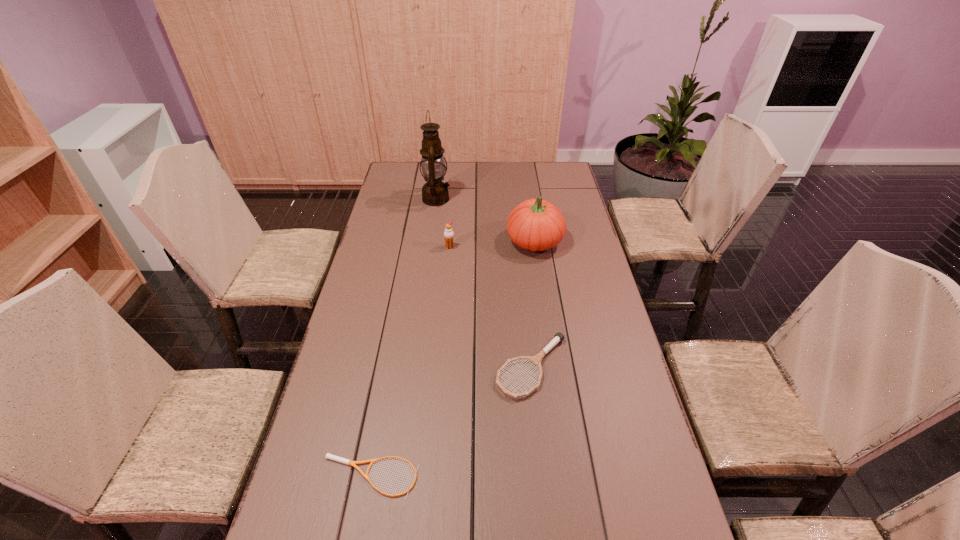
Identify the location of the closest object relative to the left tennis racket. The image size is (960, 540). (559, 337).

The height and width of the screenshot is (540, 960). Identify the location of vacant position in the image that satisfies the following two spatial constraints: 1. on the back side of the fourth farthest object; 2. on the right side of the nearer tennis racket. (390, 367).

Find the location of a particular element. This screenshot has height=540, width=960. vacant region that satisfies the following two spatial constraints: 1. on the front side of the oil lamp; 2. on the left side of the taller tennis racket is located at coordinates tap(413, 367).

At what (x,y) coordinates should I click in order to perform the action: click on free space that satisfies the following two spatial constraints: 1. on the back side of the nearer tennis racket; 2. on the right side of the oil lamp. Please return your answer as a coordinate pair (x, y). The width and height of the screenshot is (960, 540). Looking at the image, I should click on (421, 199).

I want to click on free space in the image that satisfies the following two spatial constraints: 1. at the front with a straw on the right tennis racket; 2. on the left side of the icecream, so click(x=440, y=367).